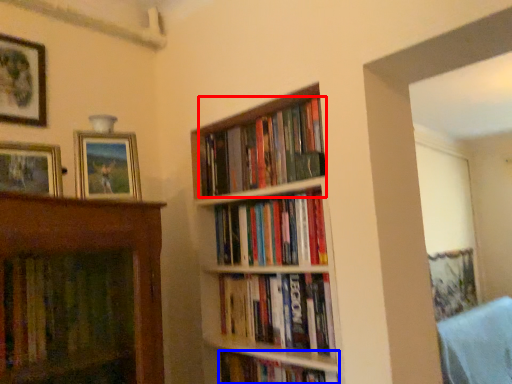
Question: Which object is further to the camera taking this photo, book (highlighted by a red box) or book (highlighted by a blue box)?

Choices:
 (A) book
 (B) book

Answer: (A)